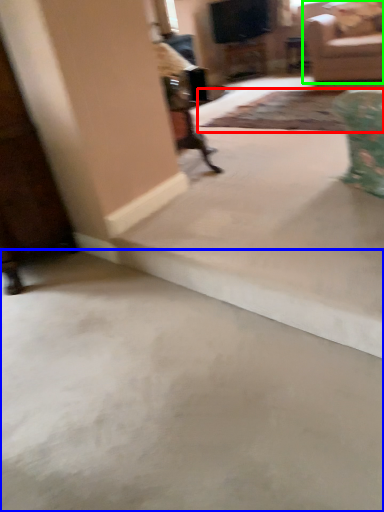
Question: Estimate the real-world distances between objects in this image. Which object is farther from mat (highlighted by a red box), concrete (highlighted by a blue box) or studio couch (highlighted by a green box)?

Choices:
 (A) concrete
 (B) studio couch

Answer: (A)